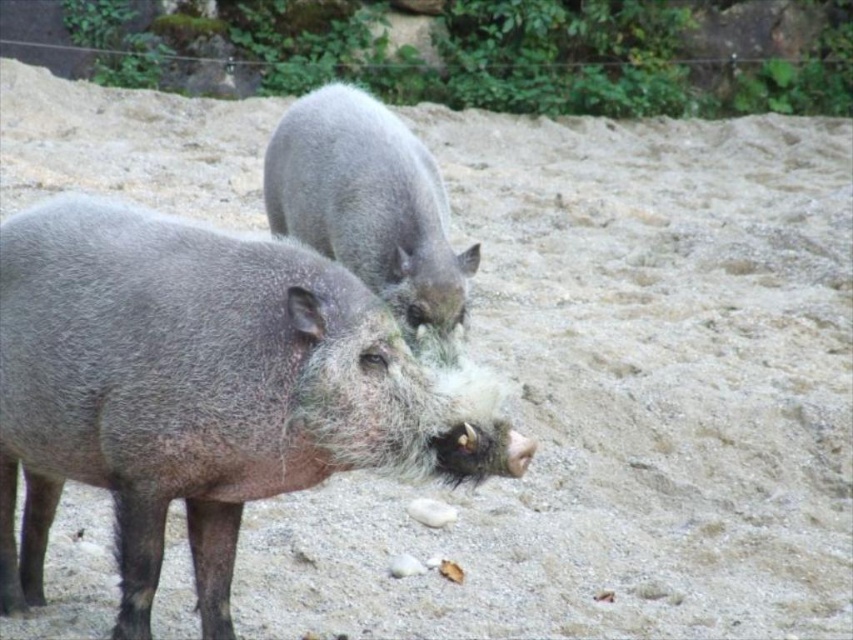
You are a wildlife photographer aiming to capture both the gray fuzzy boar at center and the fuzzy gray pig at center in a single frame. Since you want to ensure both are fully visible, which boar should you focus on first to avoid obstruction?

You should focus on the gray fuzzy boar at center first because it is much taller than the fuzzy gray pig at center, so positioning it properly will help ensure the smaller one behind is not fully obscured.

You are a wildlife photographer trying to capture both the gray fuzzy boar at center and the fuzzy gray pig at center in a single frame. Based on their positions, which boar is more likely to be blocking the view of the other?

The gray fuzzy boar at center is positioned in front of the fuzzy gray pig at center, so it is more likely to be blocking the view of the fuzzy gray pig at center.

You are a photographer trying to capture both the gray fuzzy boar at center and the fuzzy gray pig at center in a single frame. Since you want to ensure both are visible, which boar should you focus on first to avoid the other being obscured?

You should focus on the gray fuzzy boar at center first because it is positioned to the left of the fuzzy gray pig at center, so focusing on the left boar ensures the right boar remains visible without obstruction.